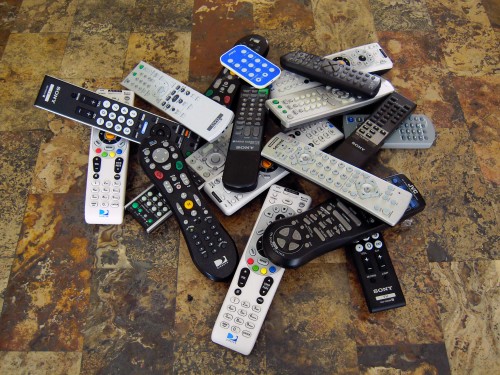
Image resolution: width=500 pixels, height=375 pixels. Find the location of `sony remote`. sony remote is located at coordinates (59, 98), (380, 289), (245, 148), (361, 148).